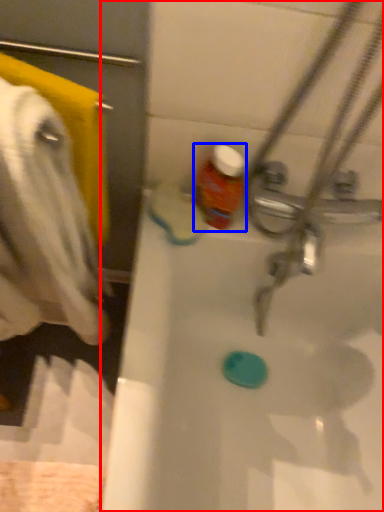
Question: Which of the following is the farthest to the observer, bathtub (highlighted by a red box) or bottle (highlighted by a blue box)?

Choices:
 (A) bathtub
 (B) bottle

Answer: (B)